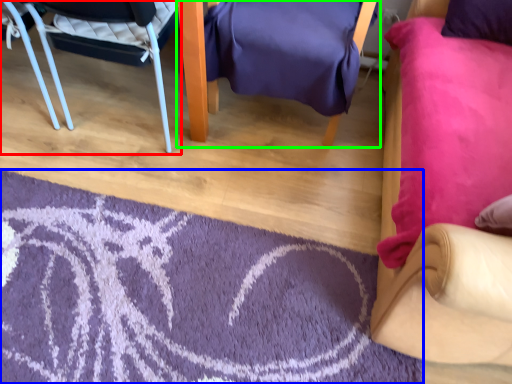
Question: Based on their relative distances, which object is farther from chair (highlighted by a red box)? Choose from mat (highlighted by a blue box) and chair (highlighted by a green box).

Choices:
 (A) mat
 (B) chair

Answer: (A)